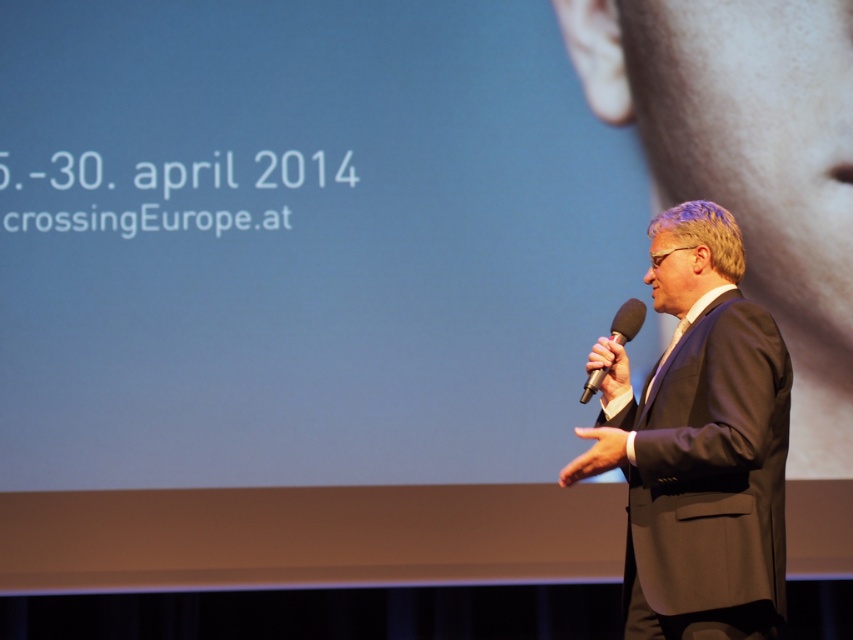
From the picture: You are an event planner looking at a photo of a speaker on stage. The speaker is wearing a matte black suit at right. If you need to place a name tag on the left side of his suit, where should you position it relative to his current position?

The name tag should be placed on the left side of the matte black suit at right, which would be opposite to the microphone hand since the microphone is in his right hand.

You are an event planner looking at the stage setup for a presentation. You notice the matte black suit at right and the black matte microphone at right. Which object is located lower on the stage?

The matte black suit at right is positioned under the black matte microphone at right, so the matte black suit at right is located lower on the stage.